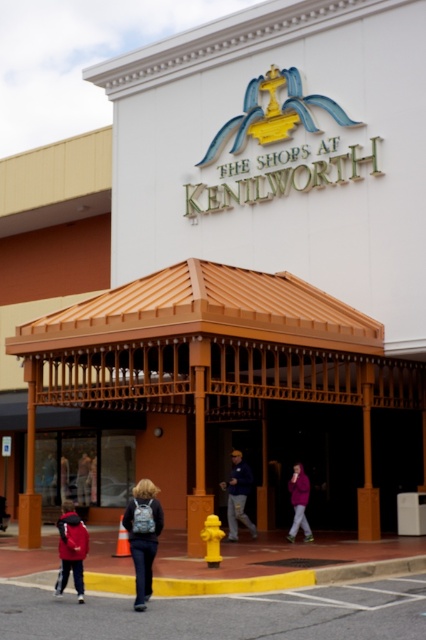
Is point (227, 483) in front of point (307, 480)?

No, (227, 483) is further to viewer.

Locate an element on the screen. dark blue jacket at center is located at coordinates (238, 496).

The image size is (426, 640). Identify the location of dark blue jacket at center. (238, 496).

Can you confirm if matte red jacket at lower left is smaller than dark blue jacket at center?

No, matte red jacket at lower left is not smaller than dark blue jacket at center.

Based on the photo, can you confirm if matte red jacket at lower left is positioned above dark blue jacket at center?

No.

Which is behind, point (57, 518) or point (256, 536)?

Positioned behind is point (57, 518).

Where is `matte red jacket at lower left`? The image size is (426, 640). matte red jacket at lower left is located at coordinates (71, 548).

Between purple fleece jacket at center and dark blue jeans at center, which one is positioned higher?

purple fleece jacket at center

Is purple fleece jacket at center closer to camera compared to dark blue jeans at center?

Yes.

Is point (293, 531) closer to viewer compared to point (81, 497)?

Yes, point (293, 531) is in front of point (81, 497).

This screenshot has height=640, width=426. What are the coordinates of `purple fleece jacket at center` in the screenshot? It's located at (299, 502).